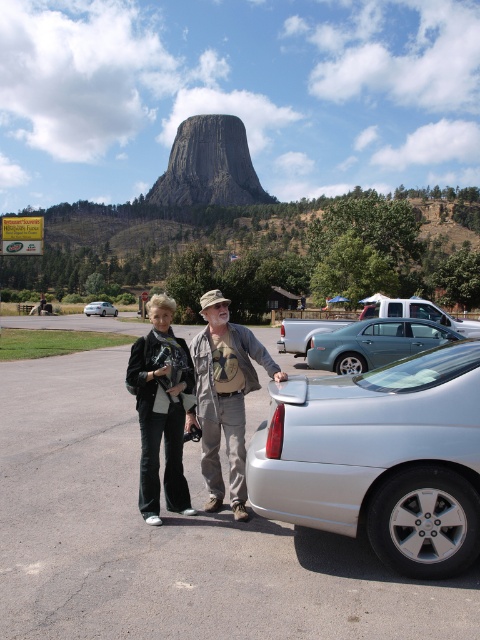
You are a photographer at the scene and want to take a picture of the silver car. The camera you are using has a focal length of 50mm. To ensure the silver car is in focus, you need to adjust the focus ring to the distance marked as 10 meters. However, there is a point at coordinates point [208,164] that might be in the way. Is this point within the area where the camera will be focused?

The point [208,164] is on the rusty stone monolith at center, so it is not part of the silver car. Therefore, adjusting the focus ring to 10 meters for the silver car will not include the point in the focused area.

You are standing at the center of the parking area and want to take a photo of the silver metallic car at lower right. Which direction should you face to ensure the car is in your camera frame?

You should face towards the lower right direction to capture the silver metallic car at lower right in your camera frame.